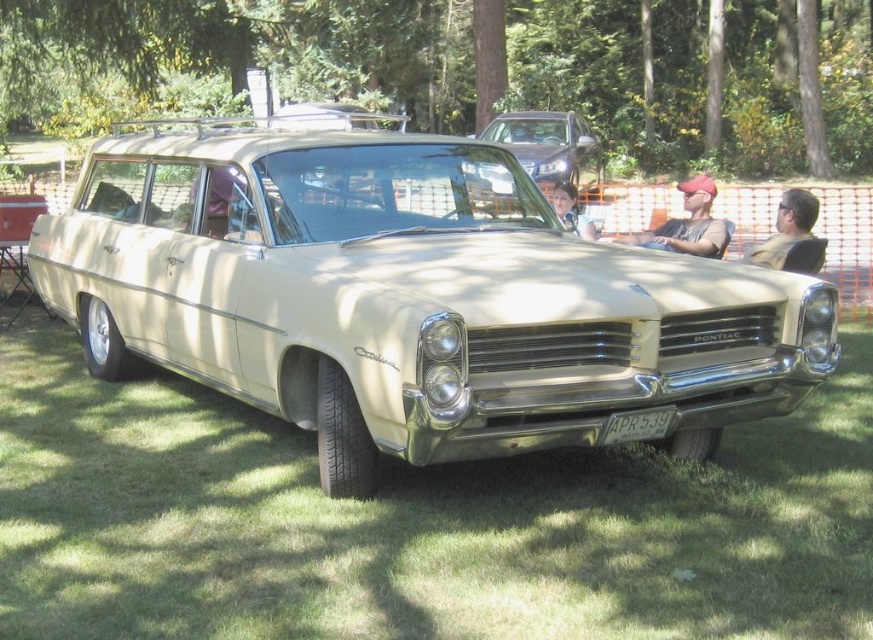
Is metallic silver station wagon at center behind matte red cap at center?

Yes.

Between point (506, 136) and point (631, 234), which one is positioned behind?

The point (506, 136) is more distant.

Image resolution: width=873 pixels, height=640 pixels. In order to click on metallic silver station wagon at center in this screenshot , I will do point(544,144).

Does green leafy tree at upper center have a greater width compared to matte red cap at center?

Yes, green leafy tree at upper center is wider than matte red cap at center.

Can you confirm if green leafy tree at upper center is bigger than matte red cap at center?

Indeed, green leafy tree at upper center has a larger size compared to matte red cap at center.

Locate an element on the screen. green leafy tree at upper center is located at coordinates (476, 68).

I want to click on green leafy tree at upper center, so click(476, 68).

Between beige metallic station wagon at center and brown leather jacket at center, which one has less height?

With less height is beige metallic station wagon at center.

Between point (167, 132) and point (802, 198), which one is positioned in front?

Point (802, 198) is in front.

The image size is (873, 640). Describe the element at coordinates (410, 298) in the screenshot. I see `beige metallic station wagon at center` at that location.

Where is `beige metallic station wagon at center`? beige metallic station wagon at center is located at coordinates (410, 298).